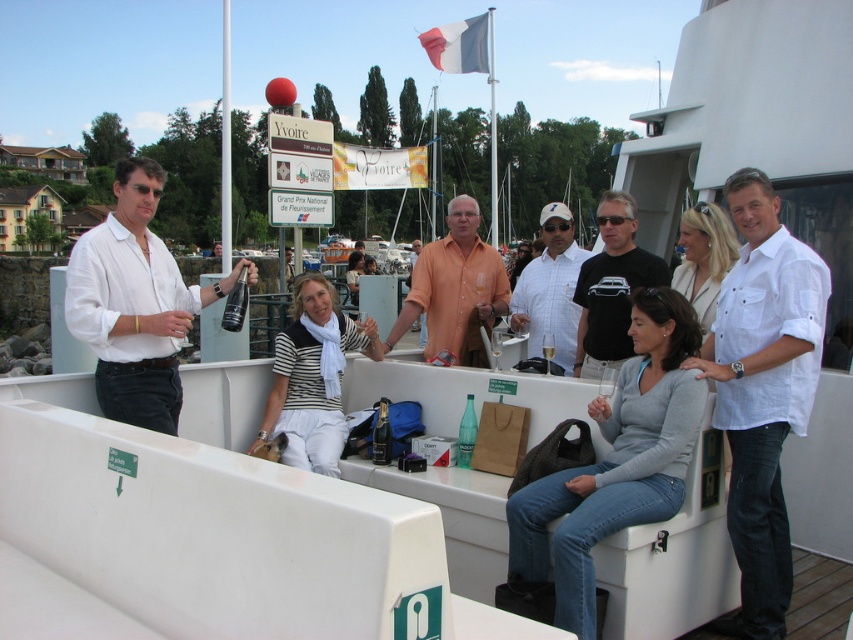
Question: Which object is the closest to the white checkered shirt at center?

Choices:
 (A) dark brown wood at lower right
 (B) black t-shirt at center

Answer: (B)

Question: Does orange matte shirt at center appear under black t-shirt at center?

Choices:
 (A) yes
 (B) no

Answer: (A)

Question: Among these points, which one is nearest to the camera?

Choices:
 (A) (149, 276)
 (B) (732, 328)
 (C) (442, 307)
 (D) (796, 609)

Answer: (B)

Question: Does white striped shirt at center have a greater width compared to orange matte shirt at center?

Choices:
 (A) yes
 (B) no

Answer: (B)

Question: Which object appears closest to the camera in this image?

Choices:
 (A) gray sweater at center
 (B) dark brown wood at lower right

Answer: (A)

Question: Observing the image, what is the correct spatial positioning of white checkered shirt at center in reference to dark brown wood at lower right?

Choices:
 (A) right
 (B) left

Answer: (B)